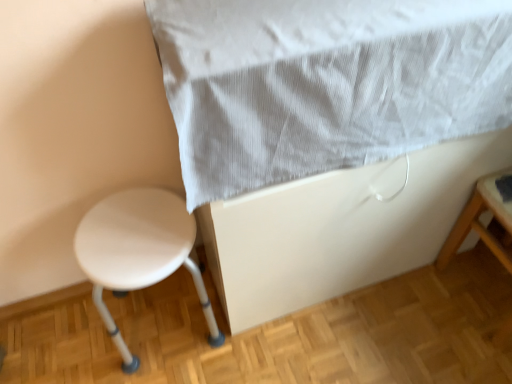
What is the approximate height of white textured fabric at upper center?

34.08 centimeters.

This screenshot has width=512, height=384. Find the location of `white textured fabric at upper center`. white textured fabric at upper center is located at coordinates (325, 83).

The width and height of the screenshot is (512, 384). What do you see at coordinates (325, 83) in the screenshot?
I see `white textured fabric at upper center` at bounding box center [325, 83].

Where is `white plastic stool at lower left`? white plastic stool at lower left is located at coordinates (139, 252).

This screenshot has height=384, width=512. What do you see at coordinates (139, 252) in the screenshot? I see `white plastic stool at lower left` at bounding box center [139, 252].

At what (x,y) coordinates should I click in order to perform the action: click on white textured fabric at upper center. Please return your answer as a coordinate pair (x, y). The image size is (512, 384). Looking at the image, I should click on (325, 83).

Considering the relative positions of white plastic stool at lower left and white textured fabric at upper center in the image provided, is white plastic stool at lower left to the right of white textured fabric at upper center from the viewer's perspective?

In fact, white plastic stool at lower left is to the left of white textured fabric at upper center.

Is white plastic stool at lower left in front of or behind white textured fabric at upper center in the image?

Clearly, white plastic stool at lower left is behind white textured fabric at upper center.

Considering the positions of points (169, 208) and (339, 40), is point (169, 208) closer to camera compared to point (339, 40)?

No, it is behind (339, 40).

From the image's perspective, between white plastic stool at lower left and white textured fabric at upper center, which one is located above?

white textured fabric at upper center, from the image's perspective.

From a real-world perspective, which is physically below, white plastic stool at lower left or white textured fabric at upper center?

white plastic stool at lower left is physically lower.

Can you confirm if white plastic stool at lower left is wider than white textured fabric at upper center?

No, white plastic stool at lower left is not wider than white textured fabric at upper center.

Does white plastic stool at lower left have a greater height compared to white textured fabric at upper center?

Correct, white plastic stool at lower left is much taller as white textured fabric at upper center.

Between white plastic stool at lower left and white textured fabric at upper center, which one has smaller size?

With smaller size is white plastic stool at lower left.

Would you say white textured fabric at upper center is part of white plastic stool at lower left's contents?

No, white textured fabric at upper center is not surrounded by white plastic stool at lower left.

Is white plastic stool at lower left directly adjacent to white textured fabric at upper center?

No, white plastic stool at lower left is not touching white textured fabric at upper center.

Is white plastic stool at lower left oriented towards white textured fabric at upper center?

No, white plastic stool at lower left is not oriented towards white textured fabric at upper center.

Identify the location of sheet on the right of white plastic stool at lower left. This screenshot has height=384, width=512. (325, 83).

Which is more to the right, white textured fabric at upper center or white plastic stool at lower left?

white textured fabric at upper center is more to the right.

From the picture: Is white textured fabric at upper center in front of or behind white plastic stool at lower left in the image?

Clearly, white textured fabric at upper center is in front of white plastic stool at lower left.

Between point (404, 113) and point (102, 237), which one is positioned in front?

Positioned in front is point (404, 113).

From the image's perspective, is white textured fabric at upper center located above or below white plastic stool at lower left?

white textured fabric at upper center is situated higher than white plastic stool at lower left in the image.

From a real-world perspective, relative to white plastic stool at lower left, is white textured fabric at upper center vertically above or below?

Clearly, from a real-world perspective, white textured fabric at upper center is above white plastic stool at lower left.

Considering the sizes of white textured fabric at upper center and white plastic stool at lower left in the image, is white textured fabric at upper center wider or thinner than white plastic stool at lower left?

white textured fabric at upper center is wider than white plastic stool at lower left.

Is white textured fabric at upper center taller or shorter than white plastic stool at lower left?

Considering their sizes, white textured fabric at upper center has less height than white plastic stool at lower left.

Considering the relative sizes of white textured fabric at upper center and white plastic stool at lower left in the image provided, is white textured fabric at upper center bigger than white plastic stool at lower left?

Correct, white textured fabric at upper center is larger in size than white plastic stool at lower left.

Based on the photo, is white textured fabric at upper center spatially inside white plastic stool at lower left, or outside of it?

white textured fabric at upper center lies outside white plastic stool at lower left.

Are white textured fabric at upper center and white plastic stool at lower left far apart?

white textured fabric at upper center is near white plastic stool at lower left, not far away.

Is white textured fabric at upper center turned away from white plastic stool at lower left?

white textured fabric at upper center is not turned away from white plastic stool at lower left.

How many degrees apart are the facing directions of white textured fabric at upper center and white plastic stool at lower left?

The facing directions of white textured fabric at upper center and white plastic stool at lower left are 0.209 degrees apart.

I want to click on sheet on the right of white plastic stool at lower left, so click(x=325, y=83).

The image size is (512, 384). I want to click on stool behind the white textured fabric at upper center, so click(139, 252).

Locate an element on the screen. stool below the white textured fabric at upper center (from a real-world perspective) is located at coordinates click(x=139, y=252).